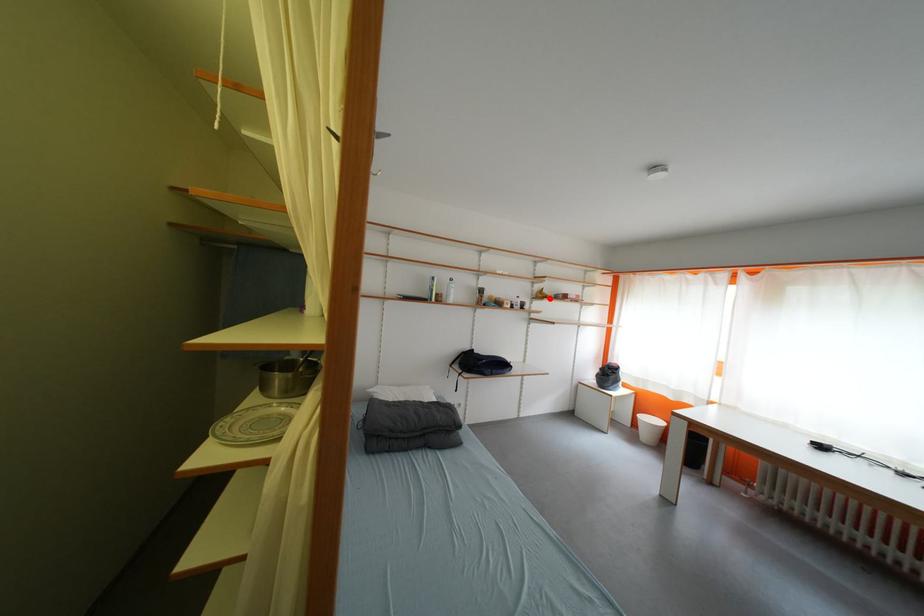
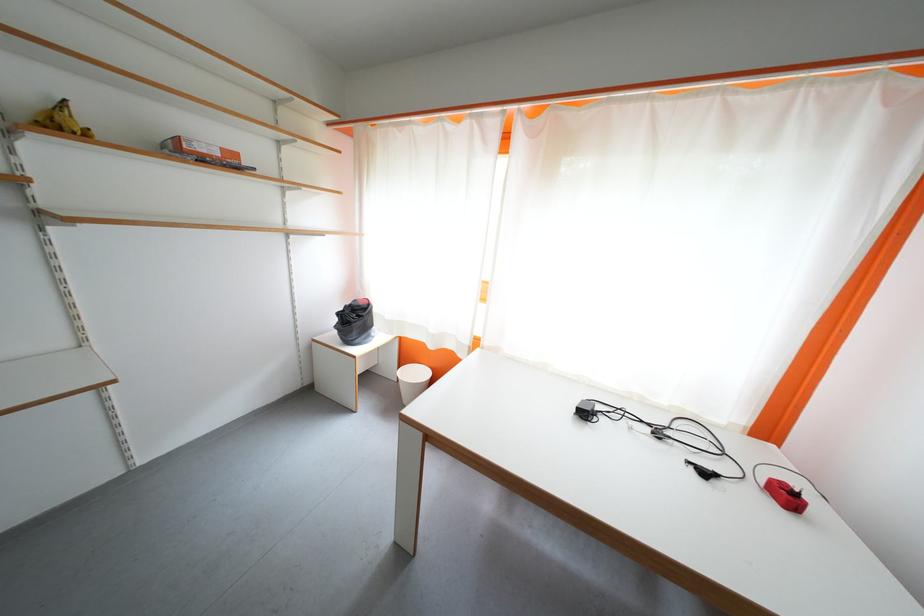
Question: I am providing you with two images of the same scene from different viewpoints. In image1, a red point is highlighted. Considering the same 3D point in image2, which of the following is correct?

Choices:
 (A) It is closer
 (B) It is farther

Answer: (B)